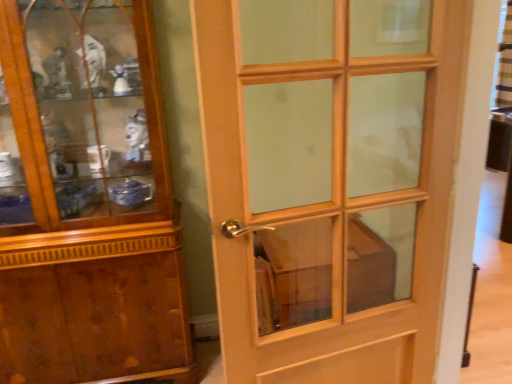
The width and height of the screenshot is (512, 384). What do you see at coordinates (331, 189) in the screenshot?
I see `light wood/glass door at center` at bounding box center [331, 189].

Identify the location of light wood/glass door at center. (331, 189).

What do you see at coordinates (86, 200) in the screenshot?
I see `wooden polished cupboard at left` at bounding box center [86, 200].

The image size is (512, 384). I want to click on wooden polished cupboard at left, so click(86, 200).

The width and height of the screenshot is (512, 384). In order to click on light wood/glass door at center in this screenshot , I will do `click(331, 189)`.

Is wooden polished cupboard at left at the left side of light wood/glass door at center?

Yes.

Based on the photo, considering the positions of objects wooden polished cupboard at left and light wood/glass door at center in the image provided, who is in front, wooden polished cupboard at left or light wood/glass door at center?

light wood/glass door at center is in front.

Considering the positions of point (145, 345) and point (422, 351), is point (145, 345) closer or farther from the camera than point (422, 351)?

Point (145, 345) is positioned farther from the camera compared to point (422, 351).

From the image's perspective, is wooden polished cupboard at left under light wood/glass door at center?

No, from the image's perspective, wooden polished cupboard at left is not below light wood/glass door at center.

From a real-world perspective, relative to light wood/glass door at center, is wooden polished cupboard at left vertically above or below?

From a real-world perspective, wooden polished cupboard at left is physically below light wood/glass door at center.

Considering the sizes of wooden polished cupboard at left and light wood/glass door at center in the image, is wooden polished cupboard at left wider or thinner than light wood/glass door at center?

wooden polished cupboard at left is wider than light wood/glass door at center.

Considering the relative sizes of wooden polished cupboard at left and light wood/glass door at center in the image provided, is wooden polished cupboard at left taller than light wood/glass door at center?

Yes, wooden polished cupboard at left is taller than light wood/glass door at center.

Between wooden polished cupboard at left and light wood/glass door at center, which one has smaller size?

Smaller between the two is light wood/glass door at center.

From the picture: Is wooden polished cupboard at left positioned beyond the bounds of light wood/glass door at center?

Absolutely, wooden polished cupboard at left is external to light wood/glass door at center.

Is wooden polished cupboard at left not close to light wood/glass door at center?

No, wooden polished cupboard at left is in close proximity to light wood/glass door at center.

Is wooden polished cupboard at left facing away from light wood/glass door at center?

No, wooden polished cupboard at left's orientation is not away from light wood/glass door at center.

Where is `cupboard behind the light wood/glass door at center`? The image size is (512, 384). cupboard behind the light wood/glass door at center is located at coordinates (86, 200).

Considering the relative positions of light wood/glass door at center and wooden polished cupboard at left in the image provided, is light wood/glass door at center to the right of wooden polished cupboard at left from the viewer's perspective?

Correct, you'll find light wood/glass door at center to the right of wooden polished cupboard at left.

Is the position of light wood/glass door at center more distant than that of wooden polished cupboard at left?

No, light wood/glass door at center is closer to the viewer.

Does point (349, 132) lie in front of point (109, 298)?

That is True.

From the image's perspective, who appears lower, light wood/glass door at center or wooden polished cupboard at left?

From the image's view, light wood/glass door at center is below.

From a real-world perspective, is light wood/glass door at center located higher than wooden polished cupboard at left?

Correct, in the physical world, light wood/glass door at center is higher than wooden polished cupboard at left.

Considering the sizes of objects light wood/glass door at center and wooden polished cupboard at left in the image provided, who is thinner, light wood/glass door at center or wooden polished cupboard at left?

light wood/glass door at center.

Is light wood/glass door at center taller or shorter than wooden polished cupboard at left?

light wood/glass door at center is shorter than wooden polished cupboard at left.

Between light wood/glass door at center and wooden polished cupboard at left, which one has smaller size?

With smaller size is light wood/glass door at center.

Is light wood/glass door at center completely or partially outside of wooden polished cupboard at left?

Yes, light wood/glass door at center is located beyond the bounds of wooden polished cupboard at left.

In the scene shown: Is the surface of light wood/glass door at center in direct contact with wooden polished cupboard at left?

There is a gap between light wood/glass door at center and wooden polished cupboard at left.

Is wooden polished cupboard at left at the back of light wood/glass door at center?

No, wooden polished cupboard at left is not at the back of light wood/glass door at center.

This screenshot has width=512, height=384. Find the location of `door on the right of wooden polished cupboard at left`. door on the right of wooden polished cupboard at left is located at coordinates (331, 189).

I want to click on cupboard located on the left of light wood/glass door at center, so (x=86, y=200).

The height and width of the screenshot is (384, 512). In order to click on cupboard lying above the light wood/glass door at center (from the image's perspective) in this screenshot , I will do [86, 200].